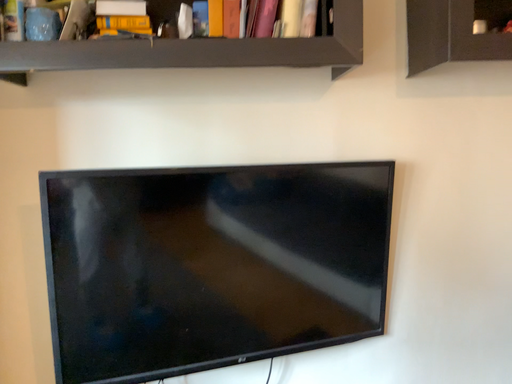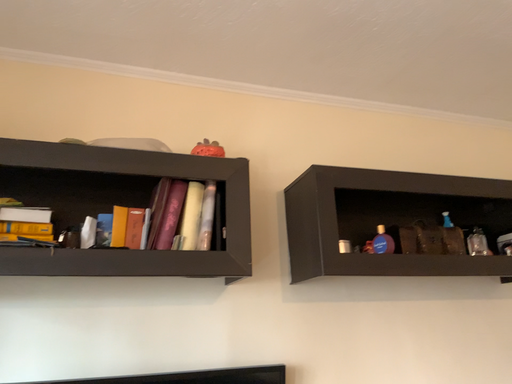
Question: How did the camera likely rotate when shooting the video?

Choices:
 (A) rotated upward
 (B) rotated downward

Answer: (A)